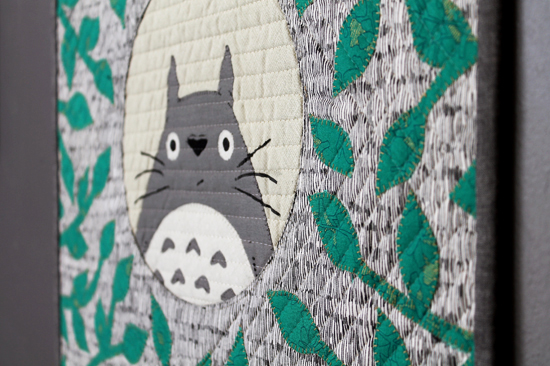
Where is `dark grey background (maybe wall)`? This screenshot has width=550, height=366. dark grey background (maybe wall) is located at coordinates (33, 180).